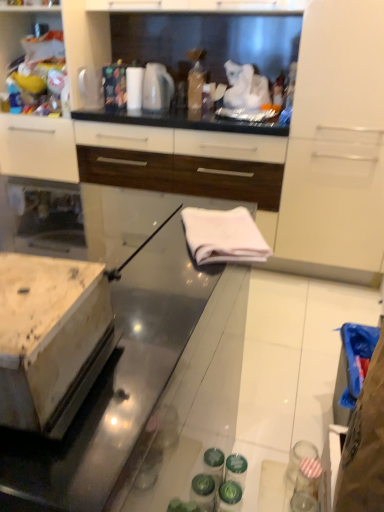
Question: Is white glossy cabinet at upper left, the second cabinetry viewed from the right, looking in the opposite direction of white glossy cabinet at upper center, which appears as the 2th cabinetry when viewed from the left?

Choices:
 (A) no
 (B) yes

Answer: (A)

Question: Considering the relative sizes of white glossy cabinet at upper left, arranged as the 1th cabinetry when viewed from the left, and white glossy cabinet at upper center, the 1th cabinetry from the right, in the image provided, is white glossy cabinet at upper left, arranged as the 1th cabinetry when viewed from the left, wider than white glossy cabinet at upper center, the 1th cabinetry from the right,?

Choices:
 (A) yes
 (B) no

Answer: (A)

Question: Is white glossy cabinet at upper left, the second cabinetry viewed from the right, positioned behind white glossy cabinet at upper center, the 1th cabinetry from the right?

Choices:
 (A) yes
 (B) no

Answer: (A)

Question: From a real-world perspective, is white glossy cabinet at upper left, the second cabinetry viewed from the right, on white glossy cabinet at upper center, the 1th cabinetry from the right?

Choices:
 (A) yes
 (B) no

Answer: (A)

Question: Does white glossy cabinet at upper left, the second cabinetry viewed from the right, come in front of white glossy cabinet at upper center, which appears as the 2th cabinetry when viewed from the left?

Choices:
 (A) yes
 (B) no

Answer: (B)

Question: Considering the positions of white fabric at center and white glossy electric kettle at upper center in the image, is white fabric at center taller or shorter than white glossy electric kettle at upper center?

Choices:
 (A) short
 (B) tall

Answer: (A)

Question: Is white fabric at center to the left or to the right of white glossy electric kettle at upper center in the image?

Choices:
 (A) left
 (B) right

Answer: (B)

Question: From a real-world perspective, is white fabric at center physically located above or below white glossy electric kettle at upper center?

Choices:
 (A) below
 (B) above

Answer: (A)

Question: Do you think white fabric at center is within white glossy electric kettle at upper center, or outside of it?

Choices:
 (A) outside
 (B) inside

Answer: (A)

Question: Relative to white glossy cabinet at upper center, the 1th cabinetry from the right, is white glossy cabinet at upper left, arranged as the 1th cabinetry when viewed from the left, in front or behind?

Choices:
 (A) front
 (B) behind

Answer: (B)

Question: Is white glossy cabinet at upper left, arranged as the 1th cabinetry when viewed from the left, bigger or smaller than white glossy cabinet at upper center, the 1th cabinetry from the right?

Choices:
 (A) big
 (B) small

Answer: (A)

Question: Is point (18, 36) positioned closer to the camera than point (69, 20)?

Choices:
 (A) farther
 (B) closer

Answer: (A)

Question: Based on their positions, is white glossy cabinet at upper left, arranged as the 1th cabinetry when viewed from the left, located to the left or right of white glossy cabinet at upper center, which appears as the 2th cabinetry when viewed from the left?

Choices:
 (A) left
 (B) right

Answer: (A)

Question: Is white glossy towel at center to the left or to the right of white glossy cabinet at upper left, the second cabinetry viewed from the right, in the image?

Choices:
 (A) right
 (B) left

Answer: (A)

Question: From the image's perspective, relative to white glossy cabinet at upper left, the second cabinetry viewed from the right, is white glossy towel at center above or below?

Choices:
 (A) above
 (B) below

Answer: (B)